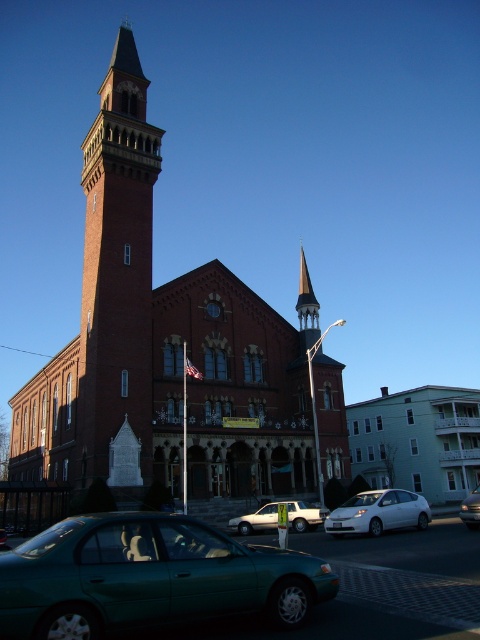
Consider the image. How much distance is there between brick bell tower at left and white matte car at lower right?

brick bell tower at left and white matte car at lower right are 94.30 feet apart from each other.

Is the position of brick bell tower at left less distant than that of white matte car at lower right?

That is False.

Who is more forward, (123, 392) or (338, 532)?

Positioned in front is point (338, 532).

The width and height of the screenshot is (480, 640). Identify the location of brick bell tower at left. (118, 276).

Can you confirm if brick church at center is wider than matte white sedan at center?

Indeed, brick church at center has a greater width compared to matte white sedan at center.

Image resolution: width=480 pixels, height=640 pixels. Describe the element at coordinates (168, 358) in the screenshot. I see `brick church at center` at that location.

Who is more forward, (236, 472) or (472, 506)?

Point (472, 506)

Identify the location of brick church at center. (168, 358).

Is green matte sedan at lower left positioned before brick bell tower at left?

Yes, it is in front of brick bell tower at left.

Describe the element at coordinates (149, 577) in the screenshot. The width and height of the screenshot is (480, 640). I see `green matte sedan at lower left` at that location.

Locate an element on the screen. green matte sedan at lower left is located at coordinates (149, 577).

This screenshot has height=640, width=480. What are the coordinates of `green matte sedan at lower left` in the screenshot? It's located at (149, 577).